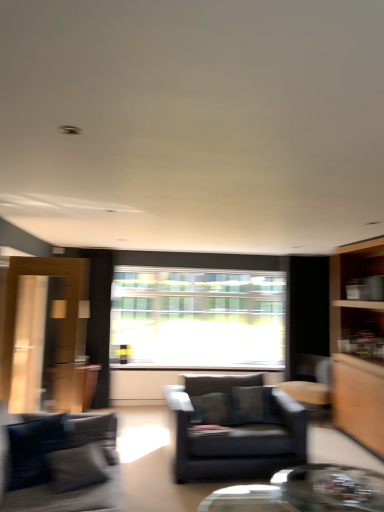
Question: Is transparent glass window at center bigger than transparent glass coffee table at lower center?

Choices:
 (A) no
 (B) yes

Answer: (B)

Question: Is transparent glass window at center outside of transparent glass coffee table at lower center?

Choices:
 (A) no
 (B) yes

Answer: (B)

Question: Does transparent glass window at center have a lesser height compared to transparent glass coffee table at lower center?

Choices:
 (A) yes
 (B) no

Answer: (B)

Question: Is transparent glass window at center positioned with its back to transparent glass coffee table at lower center?

Choices:
 (A) yes
 (B) no

Answer: (B)

Question: From the image's perspective, would you say transparent glass window at center is shown under transparent glass coffee table at lower center?

Choices:
 (A) yes
 (B) no

Answer: (B)

Question: From the image's perspective, is matte wood cabinet at left located above or below transparent glass window at center?

Choices:
 (A) above
 (B) below

Answer: (B)

Question: From a real-world perspective, is matte wood cabinet at left above or below transparent glass window at center?

Choices:
 (A) above
 (B) below

Answer: (B)

Question: Does point (79, 373) appear closer or farther from the camera than point (259, 328)?

Choices:
 (A) farther
 (B) closer

Answer: (B)

Question: In terms of height, does matte wood cabinet at left look taller or shorter compared to transparent glass window at center?

Choices:
 (A) tall
 (B) short

Answer: (B)

Question: Based on their positions, is matte wood cabinet at left located to the left or right of matte black armchair at center?

Choices:
 (A) right
 (B) left

Answer: (B)

Question: From the image's perspective, is matte wood cabinet at left located above or below matte black armchair at center?

Choices:
 (A) above
 (B) below

Answer: (B)

Question: In the image, is matte wood cabinet at left positioned in front of or behind matte black armchair at center?

Choices:
 (A) front
 (B) behind

Answer: (B)

Question: In terms of width, does matte wood cabinet at left look wider or thinner when compared to matte black armchair at center?

Choices:
 (A) wide
 (B) thin

Answer: (B)

Question: Looking at the image, does transparent glass window at center seem bigger or smaller compared to matte black armchair at center?

Choices:
 (A) big
 (B) small

Answer: (B)

Question: Would you say transparent glass window at center is to the left or to the right of matte black armchair at center in the picture?

Choices:
 (A) right
 (B) left

Answer: (B)